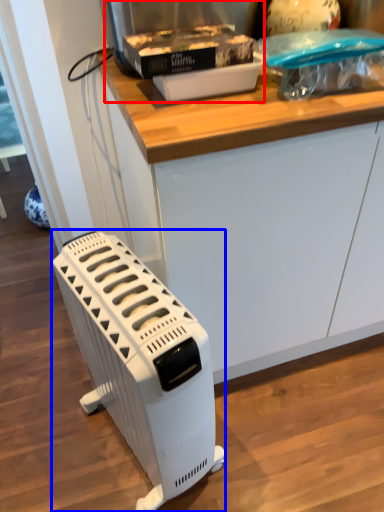
Question: Which of the following is the closest to the observer, appliance (highlighted by a red box) or home appliance (highlighted by a blue box)?

Choices:
 (A) appliance
 (B) home appliance

Answer: (B)